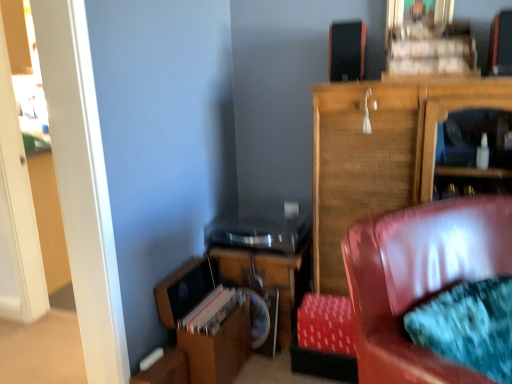
What do you see at coordinates (380, 153) in the screenshot? The image size is (512, 384). I see `wooden cabinet at upper right` at bounding box center [380, 153].

This screenshot has width=512, height=384. What do you see at coordinates (269, 279) in the screenshot?
I see `wooden table at lower center` at bounding box center [269, 279].

What do you see at coordinates (347, 50) in the screenshot?
I see `black matte speaker at upper center` at bounding box center [347, 50].

Where is `leather couch at lower right`? Image resolution: width=512 pixels, height=384 pixels. leather couch at lower right is located at coordinates (419, 279).

Locate an element on the screen. Image resolution: width=512 pixels, height=384 pixels. wooden cabinet at upper right is located at coordinates (380, 153).

Considering the sizes of red fabric footrest at lower right and black matte speaker at upper center in the image, is red fabric footrest at lower right taller or shorter than black matte speaker at upper center?

Considering their sizes, red fabric footrest at lower right has less height than black matte speaker at upper center.

Is red fabric footrest at lower right positioned beyond the bounds of black matte speaker at upper center?

red fabric footrest at lower right is positioned outside black matte speaker at upper center.

Which object is positioned more to the left, red fabric footrest at lower right or black matte speaker at upper center?

red fabric footrest at lower right.

From a real-world perspective, is red fabric footrest at lower right located beneath black matte speaker at upper center?

Yes.

From the image's perspective, is wooden table at lower center positioned above or below leather couch at lower right?

wooden table at lower center is below leather couch at lower right.

Is leather couch at lower right surrounded by wooden table at lower center?

Definitely not — leather couch at lower right is not inside wooden table at lower center.

Does wooden table at lower center have a lesser width compared to leather couch at lower right?

Indeed, wooden table at lower center has a lesser width compared to leather couch at lower right.

Does wooden table at lower center touch leather couch at lower right?

No, wooden table at lower center is not making contact with leather couch at lower right.

I want to click on cabinetry that appears on the right of wooden table at lower center, so click(x=380, y=153).

From a real-world perspective, which is physically above, wooden cabinet at upper right or wooden table at lower center?

wooden cabinet at upper right.

Is point (402, 178) closer or farther from the camera than point (234, 249)?

Point (402, 178) is positioned closer to the camera compared to point (234, 249).

How distant is wooden cabinet at upper right from wooden table at lower center?

19.28 inches.

Is point (324, 97) farther from viewer compared to point (338, 330)?

Yes, point (324, 97) is behind point (338, 330).

Is wooden cabinet at upper right not near red fabric footrest at lower right?

That's not correct — wooden cabinet at upper right is a little close to red fabric footrest at lower right.

How many degrees apart are the facing directions of wooden cabinet at upper right and red fabric footrest at lower right?

They differ by 1.7 degrees in their facing directions.

From a real-world perspective, is red fabric footrest at lower right located beneath wooden cabinet at upper right?

Yes, from a real-world perspective, red fabric footrest at lower right is beneath wooden cabinet at upper right.

Can you confirm if red fabric footrest at lower right is smaller than wooden cabinet at upper right?

Yes, red fabric footrest at lower right is smaller than wooden cabinet at upper right.

Considering the sizes of red fabric footrest at lower right and wooden cabinet at upper right in the image, is red fabric footrest at lower right taller or shorter than wooden cabinet at upper right?

Considering their sizes, red fabric footrest at lower right has less height than wooden cabinet at upper right.

Image resolution: width=512 pixels, height=384 pixels. Find the location of `speaker above the red fabric footrest at lower right (from a real-world perspective)`. speaker above the red fabric footrest at lower right (from a real-world perspective) is located at coordinates (347, 50).

Does black matte speaker at upper center turn towards red fabric footrest at lower right?

No, black matte speaker at upper center is not oriented towards red fabric footrest at lower right.

Is point (344, 50) behind point (342, 351)?

That is True.

Does black matte speaker at upper center touch red fabric footrest at lower right?

They are not placed beside each other.

Which is farther from the camera, (387, 293) or (284, 328)?

Positioned behind is point (284, 328).

Considering the sizes of leather couch at lower right and wooden table at lower center in the image, is leather couch at lower right bigger or smaller than wooden table at lower center?

Clearly, leather couch at lower right is larger in size than wooden table at lower center.

From a real-world perspective, is leather couch at lower right physically located above or below wooden table at lower center?

leather couch at lower right is situated higher than wooden table at lower center in the real world.

Identify the location of the footrest that is in front of the black matte speaker at upper center. The image size is (512, 384). (325, 339).

Find the location of a particular element. The height and width of the screenshot is (384, 512). table on the left of leather couch at lower right is located at coordinates (269, 279).

Estimate the real-world distances between objects in this image. Which object is closer to red fabric footrest at lower right, wooden cabinet at upper right or wooden table at lower center?

wooden table at lower center is closer to red fabric footrest at lower right.

Considering their positions, is black matte speaker at upper center positioned further to leather couch at lower right than wooden cabinet at upper right?

black matte speaker at upper center lies further to leather couch at lower right than the other object.

When comparing their distances from wooden table at lower center, does wooden cabinet at upper right or leather couch at lower right seem further?

leather couch at lower right is positioned further to the anchor wooden table at lower center.

Looking at the image, which one is located closer to wooden cabinet at upper right, red fabric footrest at lower right or black matte speaker at upper center?

Based on the image, black matte speaker at upper center appears to be nearer to wooden cabinet at upper right.

Estimate the real-world distances between objects in this image. Which object is further from leather couch at lower right, wooden table at lower center or black matte speaker at upper center?

Based on the image, black matte speaker at upper center appears to be further to leather couch at lower right.

Looking at the image, which one is located closer to wooden cabinet at upper right, black matte speaker at upper center or red fabric footrest at lower right?

Among the two, black matte speaker at upper center is located nearer to wooden cabinet at upper right.

From the picture: Considering their positions, is wooden table at lower center positioned further to black matte speaker at upper center than red fabric footrest at lower right?

Among the two, red fabric footrest at lower right is located further to black matte speaker at upper center.

When comparing their distances from leather couch at lower right, does black matte speaker at upper center or red fabric footrest at lower right seem closer?

red fabric footrest at lower right is closer to leather couch at lower right.

Where is `cabinetry between black matte speaker at upper center and red fabric footrest at lower right in the up-down direction`? cabinetry between black matte speaker at upper center and red fabric footrest at lower right in the up-down direction is located at coordinates (380, 153).

The height and width of the screenshot is (384, 512). I want to click on cabinetry located between leather couch at lower right and red fabric footrest at lower right in the depth direction, so click(x=380, y=153).

Find the location of a particular element. The image size is (512, 384). footrest between wooden table at lower center and wooden cabinet at upper right from left to right is located at coordinates (325, 339).

The width and height of the screenshot is (512, 384). I want to click on table between black matte speaker at upper center and red fabric footrest at lower right vertically, so click(x=269, y=279).